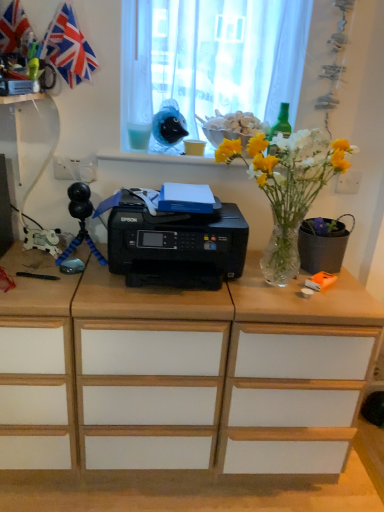
Question: Considering the relative sizes of clear glass vase at center and black plastic printer at center in the image provided, is clear glass vase at center smaller than black plastic printer at center?

Choices:
 (A) yes
 (B) no

Answer: (B)

Question: From the image's perspective, is clear glass vase at center on top of black plastic printer at center?

Choices:
 (A) no
 (B) yes

Answer: (B)

Question: Does clear glass vase at center appear on the right side of black plastic printer at center?

Choices:
 (A) no
 (B) yes

Answer: (B)

Question: Is clear glass vase at center closer to camera compared to black plastic printer at center?

Choices:
 (A) no
 (B) yes

Answer: (B)

Question: Is the depth of clear glass vase at center greater than that of black plastic printer at center?

Choices:
 (A) yes
 (B) no

Answer: (B)

Question: Are clear glass vase at center and black plastic printer at center located far from each other?

Choices:
 (A) yes
 (B) no

Answer: (B)

Question: Considering the relative sizes of green glass bottle at upper right, which ranks as the 1th stationery in right-to-left order, and clear glass vase at center in the image provided, is green glass bottle at upper right, which ranks as the 1th stationery in right-to-left order, taller than clear glass vase at center?

Choices:
 (A) yes
 (B) no

Answer: (B)

Question: Can you confirm if green glass bottle at upper right, the 2th stationery viewed from the left, is shorter than clear glass vase at center?

Choices:
 (A) no
 (B) yes

Answer: (B)

Question: Can you confirm if green glass bottle at upper right, which ranks as the 1th stationery in right-to-left order, is thinner than clear glass vase at center?

Choices:
 (A) yes
 (B) no

Answer: (A)

Question: Is green glass bottle at upper right, the 2th stationery viewed from the left, oriented away from clear glass vase at center?

Choices:
 (A) yes
 (B) no

Answer: (B)

Question: From a real-world perspective, is green glass bottle at upper right, the 2th stationery viewed from the left, positioned under clear glass vase at center based on gravity?

Choices:
 (A) yes
 (B) no

Answer: (B)

Question: Can you see green glass bottle at upper right, which ranks as the 1th stationery in right-to-left order, touching clear glass vase at center?

Choices:
 (A) no
 (B) yes

Answer: (A)

Question: Is the position of red fabric flag at upper left less distant than that of black matte flowerpot at right?

Choices:
 (A) yes
 (B) no

Answer: (A)